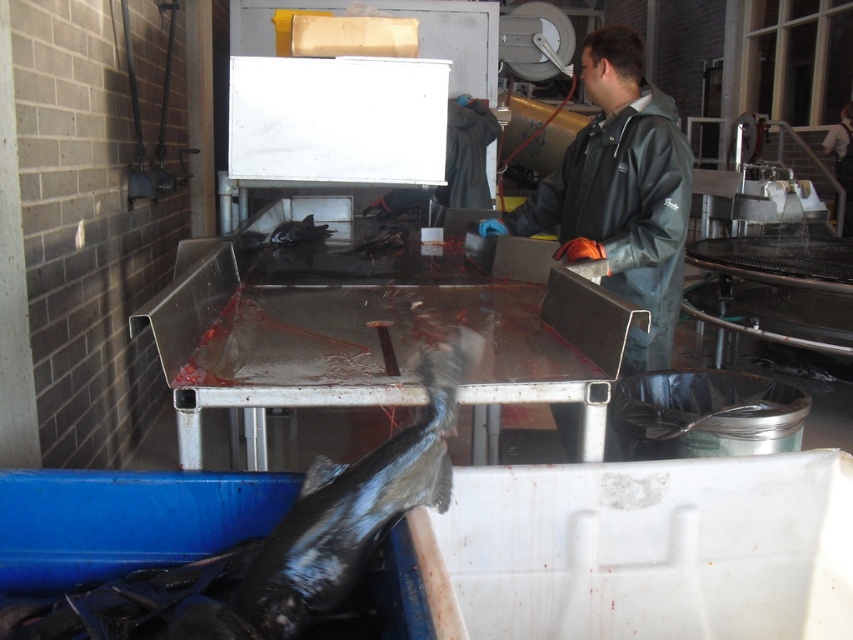
You are an inspector in the fish processing facility. You need to check the distance between the black leather jacket at center and the shiny black fish at lower left. Which object is closer to you?

The black leather jacket at center is closer to you because it is further to the viewer than the shiny black fish at lower left.

You are a worker in the fish processing facility and need to place both the black leather jacket at center and the shiny black fish at lower left onto a shelf that can only hold items narrower than 30 cm. Can both items fit on the shelf?

The black leather jacket at center might be wider than 30 cm, so it may not fit on the shelf. The shiny black fish at lower left is narrower, so it can fit. Therefore, only the shiny black fish at lower left can be placed on the shelf.